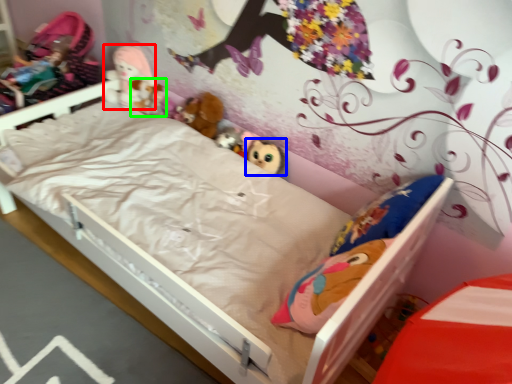
Question: Which object is positioned closest to doll (highlighted by a red box)? Select from toy (highlighted by a blue box) and toy (highlighted by a green box).

Choices:
 (A) toy
 (B) toy

Answer: (B)